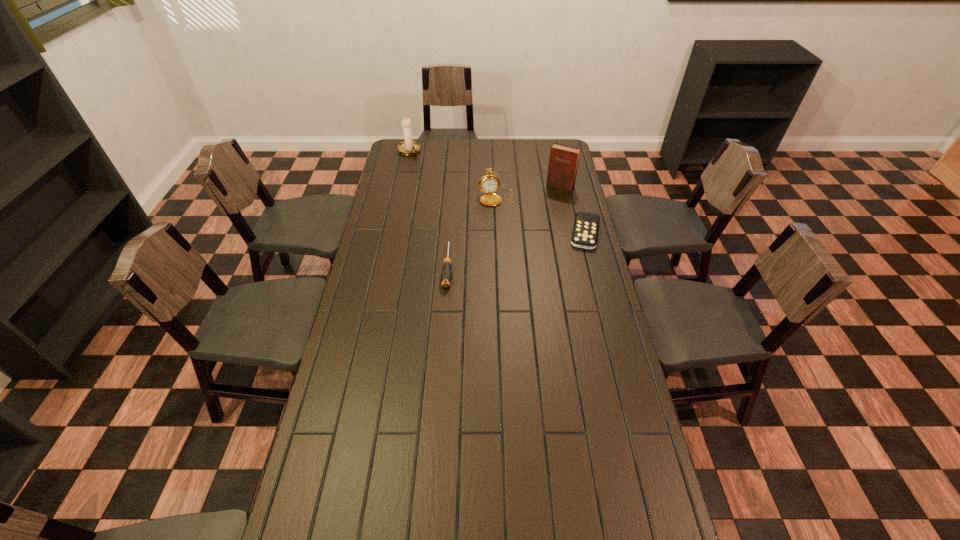
In order to click on free space on the desktop that is between the fourth object from right to left and the remote control and is positioned on the front cover of the diary in this screenshot , I will do `click(523, 248)`.

This screenshot has width=960, height=540. Find the location of `vacant space on the desktop that is between the screwdriver and the shortest object and is positioned on the face of the pocket watch`. vacant space on the desktop that is between the screwdriver and the shortest object and is positioned on the face of the pocket watch is located at coordinates (511, 251).

Locate an element on the screen. free spot on the desktop that is between the screwdriver and the shortest object and is positioned on the handle side of the leftmost object is located at coordinates (519, 248).